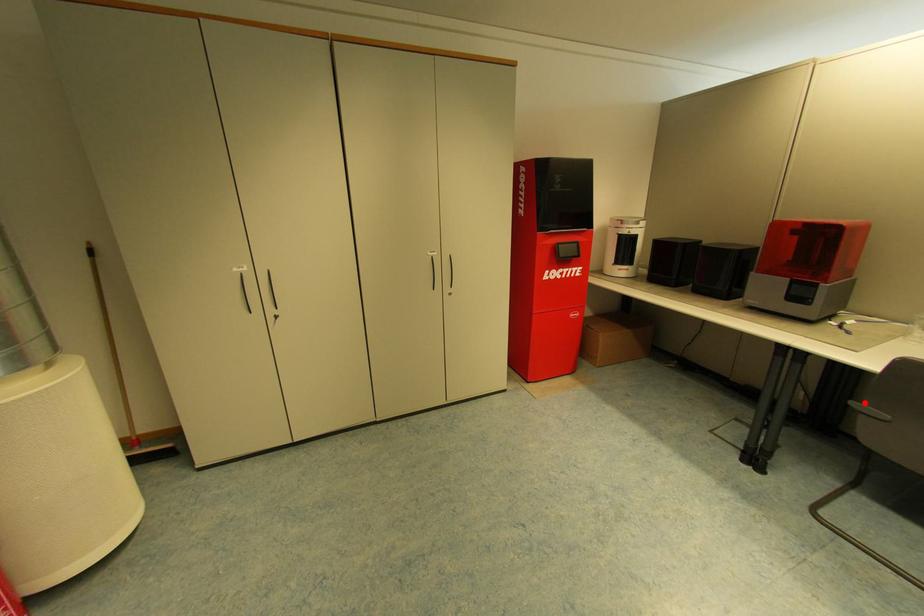
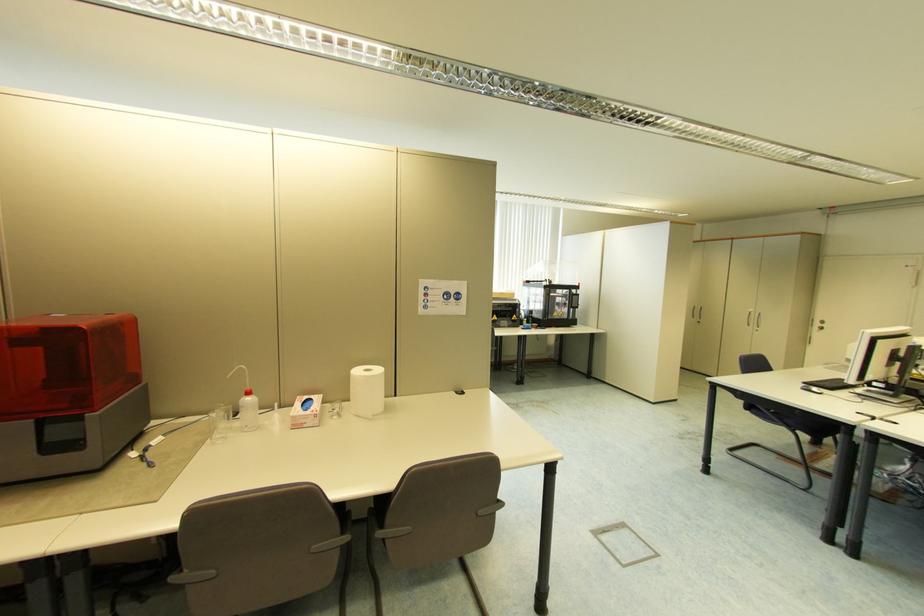
Where in the second image is the point corresponding to the highlighted location from the first image?

(185, 572)